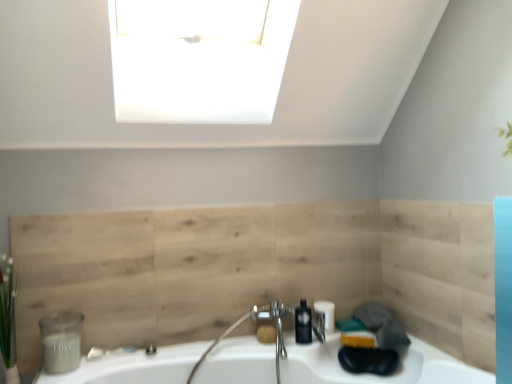
Question: Is matte gray container at lower left, the 1th toiletry when ordered from front to back, turned away from green leafy plant at left?

Choices:
 (A) yes
 (B) no

Answer: (B)

Question: Can you confirm if matte gray container at lower left, the second toiletry positioned from the right, is thinner than green leafy plant at left?

Choices:
 (A) yes
 (B) no

Answer: (A)

Question: From the image's perspective, would you say matte gray container at lower left, the second toiletry positioned from the right, is shown under green leafy plant at left?

Choices:
 (A) yes
 (B) no

Answer: (A)

Question: Is matte gray container at lower left, the second toiletry positioned from the right, not close to green leafy plant at left?

Choices:
 (A) yes
 (B) no

Answer: (B)

Question: Would you say matte gray container at lower left, the second toiletry in the back-to-front sequence, contains green leafy plant at left?

Choices:
 (A) no
 (B) yes

Answer: (A)

Question: Is point (11, 311) positioned closer to the camera than point (72, 314)?

Choices:
 (A) closer
 (B) farther

Answer: (A)

Question: Is green leafy plant at left taller or shorter than matte gray container at lower left, the 1th toiletry when ordered from front to back?

Choices:
 (A) tall
 (B) short

Answer: (A)

Question: Is green leafy plant at left inside the boundaries of matte gray container at lower left, the 1th toiletry when ordered from front to back, or outside?

Choices:
 (A) inside
 (B) outside

Answer: (B)

Question: From a real-world perspective, is green leafy plant at left positioned above or below matte gray container at lower left, the 1th toiletry when ordered from front to back?

Choices:
 (A) above
 (B) below

Answer: (A)

Question: In the image, is polished chrome faucet at center positioned in front of or behind white glossy sink at lower center?

Choices:
 (A) behind
 (B) front

Answer: (A)

Question: From a real-world perspective, is polished chrome faucet at center above or below white glossy sink at lower center?

Choices:
 (A) above
 (B) below

Answer: (A)

Question: Considering the positions of polished chrome faucet at center and white glossy sink at lower center in the image, is polished chrome faucet at center taller or shorter than white glossy sink at lower center?

Choices:
 (A) tall
 (B) short

Answer: (A)

Question: Is polished chrome faucet at center to the left or to the right of white glossy sink at lower center in the image?

Choices:
 (A) left
 (B) right

Answer: (A)

Question: Considering the positions of matte gray container at lower left, the second toiletry positioned from the right, and polished chrome faucet at center in the image, is matte gray container at lower left, the second toiletry positioned from the right, taller or shorter than polished chrome faucet at center?

Choices:
 (A) short
 (B) tall

Answer: (A)

Question: From the image's perspective, is matte gray container at lower left, the 1th toiletry when ordered from front to back, located above or below polished chrome faucet at center?

Choices:
 (A) above
 (B) below

Answer: (A)